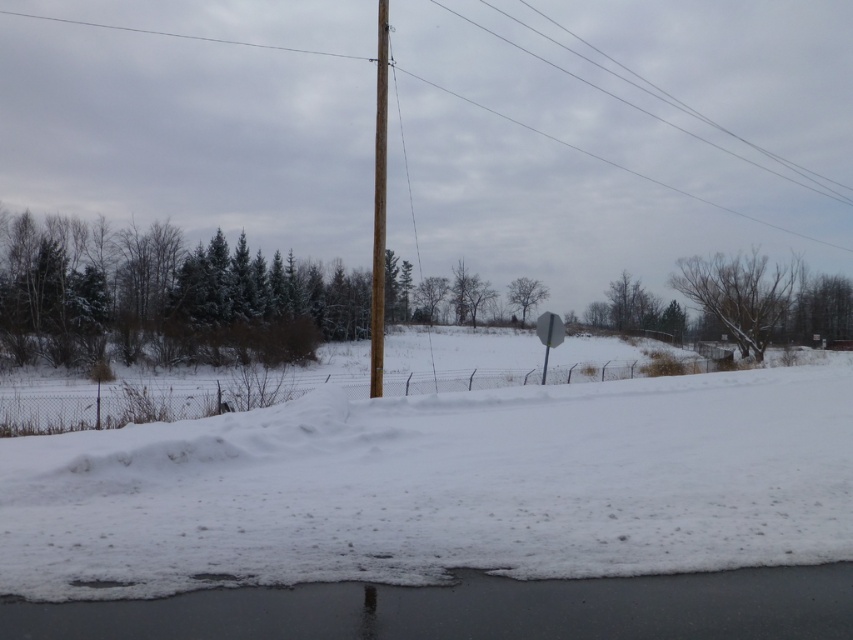
You are a drone operator trying to land a drone on the white fluffy snow at lower center. The drone has a GPS coordinate system where the bottom left corner of the image is the origin point. What are the coordinates where you should aim to land the drone?

The white fluffy snow at lower center is located at coordinates point (440, 486), so you should aim for that point to land the drone.

You are a delivery driver who needs to avoid obstacles on the road. You see the white foam at lower center and the gray matte sign at center. Which one is wider so you can plan your route accordingly?

The white foam at lower center is wider than the gray matte sign at center, so you should plan your route to avoid the wider white foam at lower center.